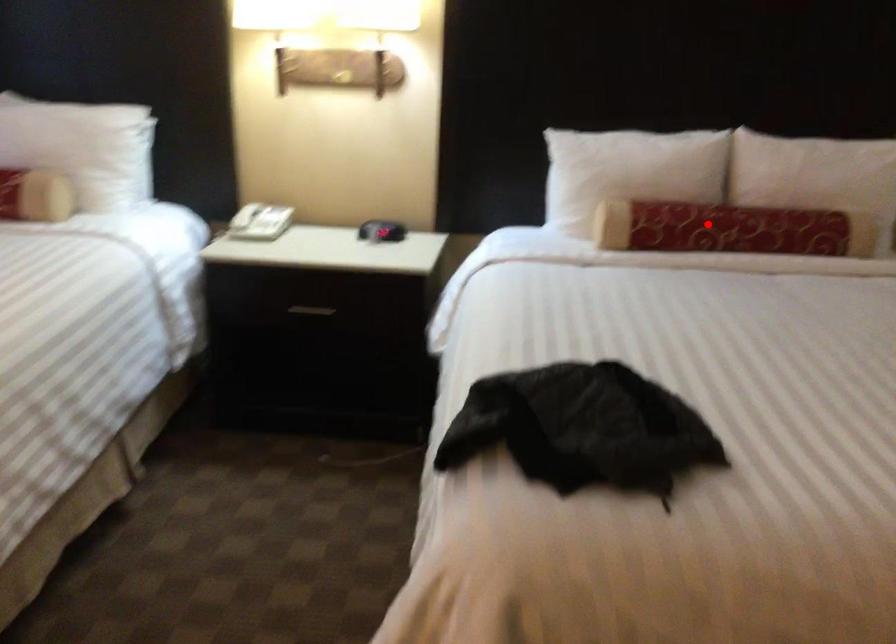
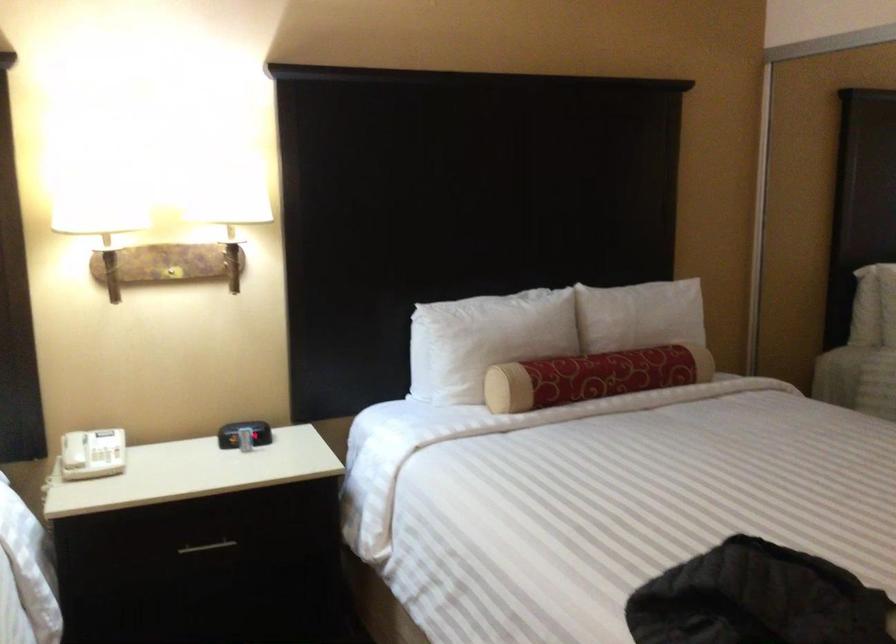
Question: I am providing you with two images of the same scene from different viewpoints. A red point is marked on the first image. At the location where the point appears in image 1, is it still visible in image 2?

Choices:
 (A) Yes
 (B) No

Answer: (A)